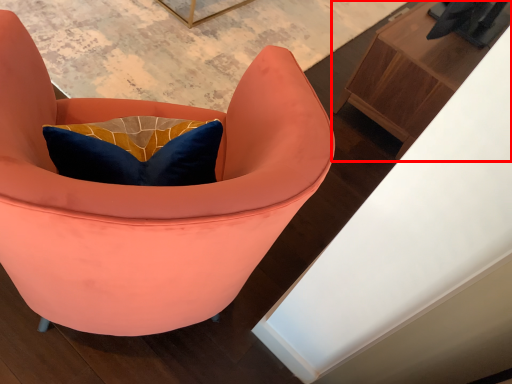
Question: From the image's perspective, what is the correct spatial relationship of furniture (annotated by the red box) in relation to chair?

Choices:
 (A) above
 (B) below

Answer: (A)